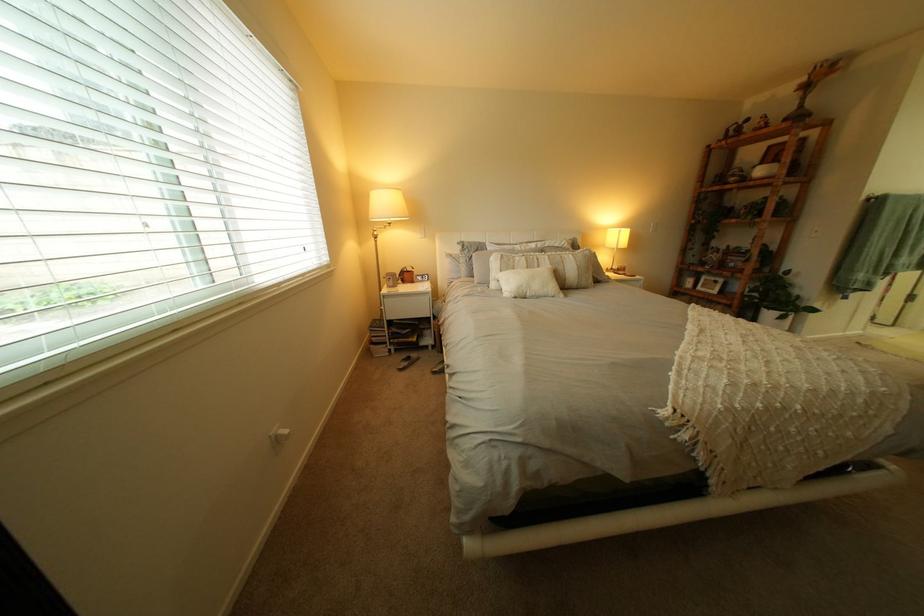
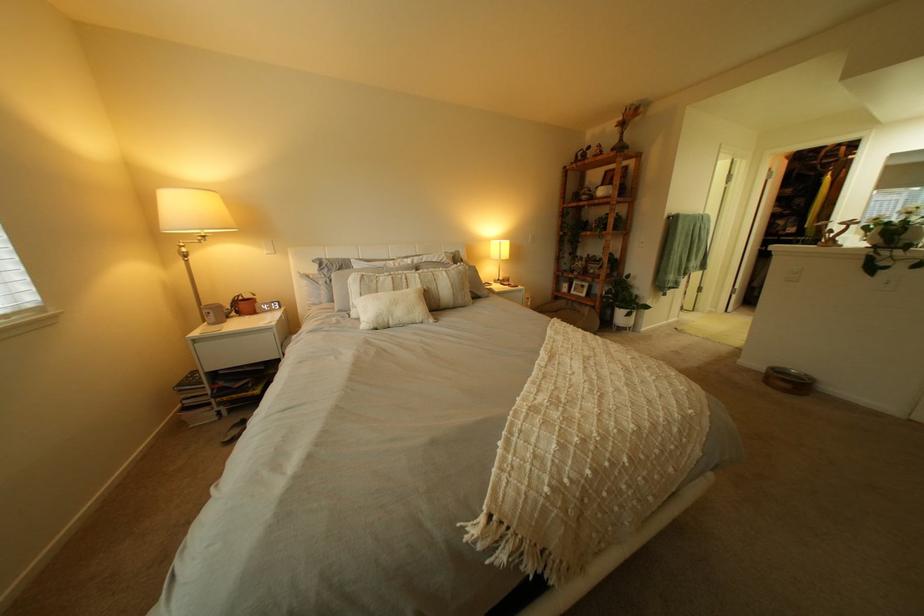
Locate, in the second image, the point that corresponds to pixel 406 280 in the first image.

(225, 314)